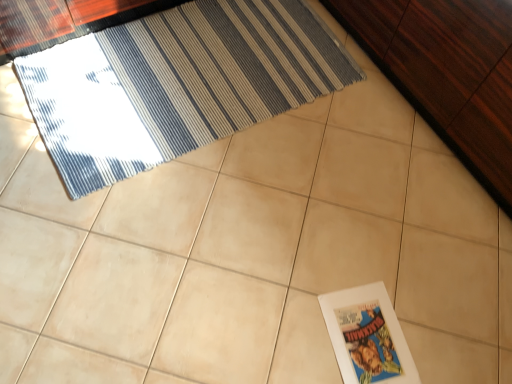
Question: Should I look upward or downward to see blue striped rug at upper left?

Choices:
 (A) up
 (B) down

Answer: (A)

Question: Can you confirm if white paper at lower right is taller than dark wood dresser at upper right?

Choices:
 (A) no
 (B) yes

Answer: (A)

Question: Would you say white paper at lower right is a long distance from dark wood dresser at upper right?

Choices:
 (A) yes
 (B) no

Answer: (B)

Question: Is white paper at lower right to the left of dark wood dresser at upper right from the viewer's perspective?

Choices:
 (A) yes
 (B) no

Answer: (A)

Question: From a real-world perspective, does white paper at lower right stand above dark wood dresser at upper right?

Choices:
 (A) yes
 (B) no

Answer: (B)

Question: Does white paper at lower right come in front of dark wood dresser at upper right?

Choices:
 (A) no
 (B) yes

Answer: (A)

Question: Is white paper at lower right further to camera compared to dark wood dresser at upper right?

Choices:
 (A) no
 (B) yes

Answer: (B)

Question: Is dark wood dresser at upper right oriented away from white paper at lower right?

Choices:
 (A) no
 (B) yes

Answer: (A)

Question: Is dark wood dresser at upper right smaller than white paper at lower right?

Choices:
 (A) yes
 (B) no

Answer: (B)

Question: From the image's perspective, is dark wood dresser at upper right under white paper at lower right?

Choices:
 (A) no
 (B) yes

Answer: (A)

Question: Is dark wood dresser at upper right touching white paper at lower right?

Choices:
 (A) no
 (B) yes

Answer: (A)

Question: Is dark wood dresser at upper right not near white paper at lower right?

Choices:
 (A) yes
 (B) no

Answer: (B)

Question: Is dark wood dresser at upper right to the right of white paper at lower right from the viewer's perspective?

Choices:
 (A) yes
 (B) no

Answer: (A)

Question: Can you confirm if blue striped rug at upper left is shorter than dark wood dresser at upper right?

Choices:
 (A) yes
 (B) no

Answer: (A)